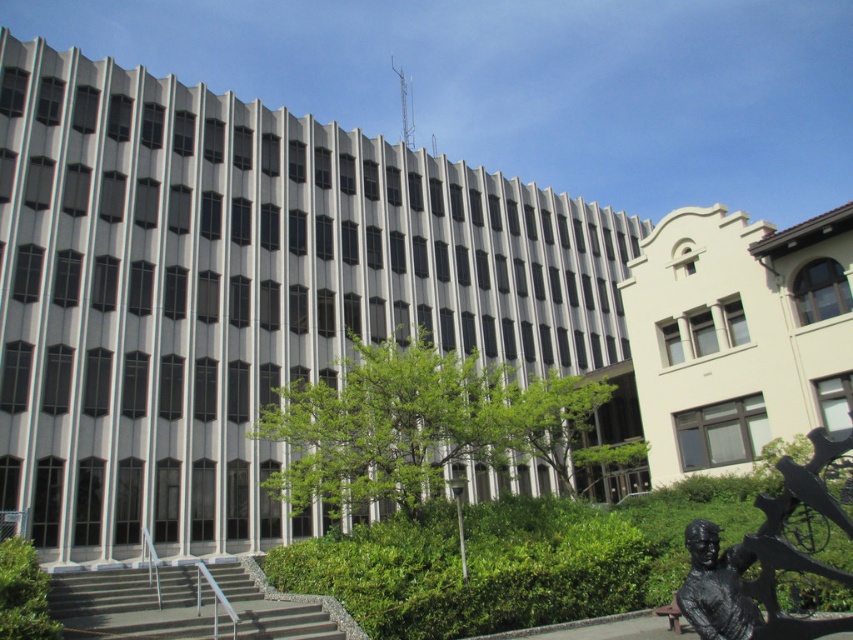
Which is more to the left, black bronze statue at lower right or gray concrete stairs at lower left?

gray concrete stairs at lower left is more to the left.

The width and height of the screenshot is (853, 640). What are the coordinates of `black bronze statue at lower right` in the screenshot? It's located at (764, 557).

Between gray concrete stairs at lower left and black polished statue at lower right, which one appears on the right side from the viewer's perspective?

Positioned to the right is black polished statue at lower right.

Looking at this image, which is below, gray concrete stairs at lower left or black polished statue at lower right?

gray concrete stairs at lower left is lower down.

Which is in front, point (102, 582) or point (722, 621)?

Point (722, 621)

Identify the location of gray concrete stairs at lower left. The image size is (853, 640). (131, 604).

Is black bronze statue at lower right to the right of black polished statue at lower right from the viewer's perspective?

Indeed, black bronze statue at lower right is positioned on the right side of black polished statue at lower right.

Is point (704, 544) positioned behind point (695, 618)?

Yes, point (704, 544) is farther from viewer.

Measure the distance between black bronze statue at lower right and camera.

The distance of black bronze statue at lower right from camera is 22.32 feet.

You are a GUI agent. You are given a task and a screenshot of the screen. Output one action in this format:
    pyautogui.click(x=<x>, y=<y>)
    Task: Click on the black bronze statue at lower right
    Image resolution: width=853 pixels, height=640 pixels.
    Given the screenshot: What is the action you would take?
    pyautogui.click(x=764, y=557)